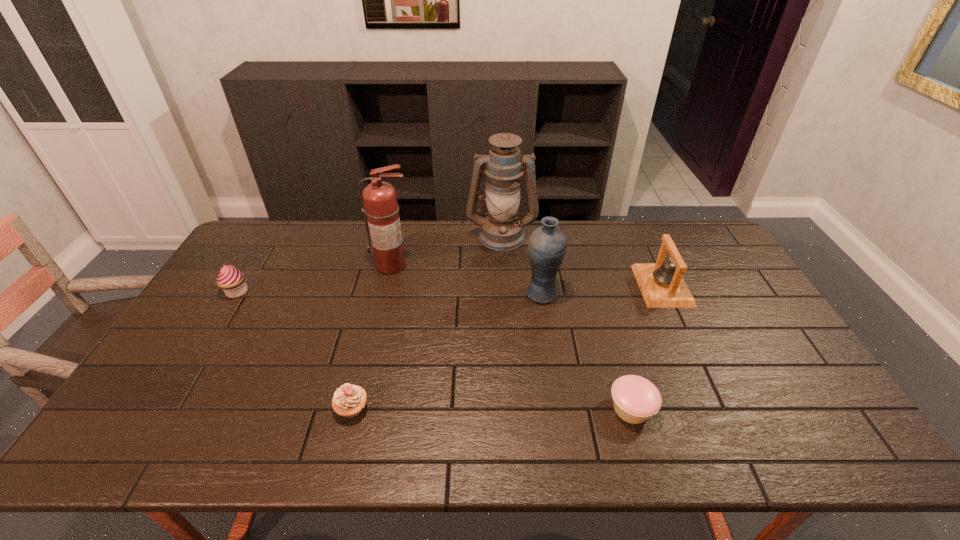
You are a GUI agent. You are given a task and a screenshot of the screen. Output one action in this format:
    pyautogui.click(x=<x>, y=<y>)
    Task: Click on the object that is at the left edge
    The height and width of the screenshot is (540, 960).
    Given the screenshot: What is the action you would take?
    pyautogui.click(x=231, y=280)

Find the location of a particular element. Image resolution: width=960 pixels, height=540 pixels. free spot at the far edge of the desktop is located at coordinates (582, 224).

Where is `free location at the near edge`? The image size is (960, 540). free location at the near edge is located at coordinates (483, 452).

In the image, there is a desktop. Identify the location of vacant space at the left edge. The width and height of the screenshot is (960, 540). (224, 315).

Find the location of a particular element. The height and width of the screenshot is (540, 960). vacant region at the right edge is located at coordinates (748, 350).

The image size is (960, 540). In the image, there is a desktop. What are the coordinates of `vacant area at the far right corner` in the screenshot? It's located at (713, 246).

This screenshot has width=960, height=540. In order to click on vacant area between the rightmost object and the sixth tallest object in this screenshot , I will do `click(507, 347)`.

Where is `free space between the rightmost object and the fire extinguisher`? The height and width of the screenshot is (540, 960). free space between the rightmost object and the fire extinguisher is located at coordinates (527, 275).

Identify the location of free space between the bell and the farthest object. Image resolution: width=960 pixels, height=540 pixels. (582, 260).

Image resolution: width=960 pixels, height=540 pixels. Identify the location of free space between the leftmost object and the second shortest cupcake. (295, 350).